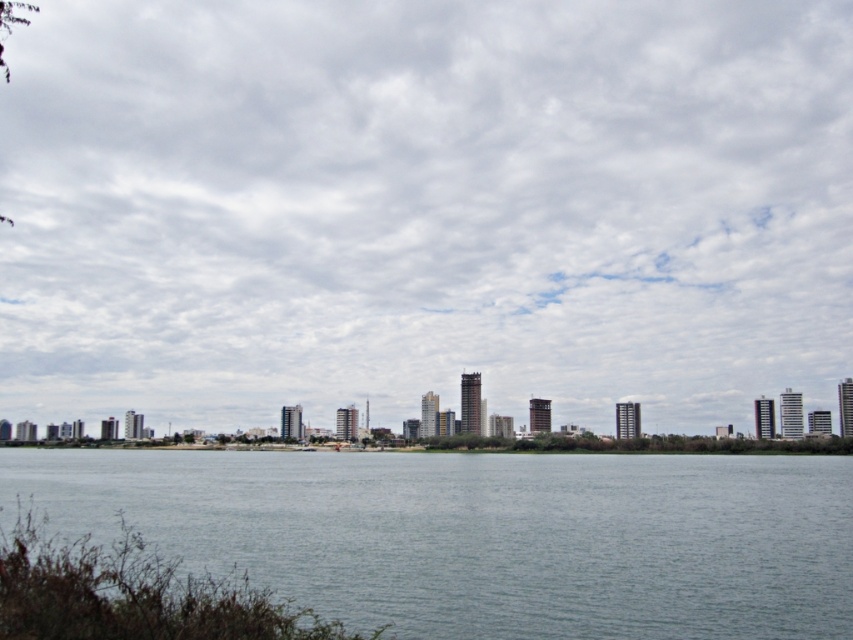
Between point (383, 547) and point (48, 557), which one is positioned behind?

The point (383, 547) is behind.

Who is higher up, gray water at center or green leafy shrub at lower left?

green leafy shrub at lower left is above.

Who is more forward, (213, 496) or (15, 625)?

Point (15, 625) is in front.

Where is `gray water at center`? This screenshot has width=853, height=640. gray water at center is located at coordinates (483, 534).

Is point (178, 221) farther from camera compared to point (582, 481)?

Yes, it is.

Image resolution: width=853 pixels, height=640 pixels. Describe the element at coordinates (424, 209) in the screenshot. I see `cloudy sky at upper center` at that location.

I want to click on cloudy sky at upper center, so click(x=424, y=209).

Who is more distant from viewer, [158,349] or [335,621]?

Positioned behind is point [158,349].

Does cloudy sky at upper center appear over green leafy shrub at lower left?

Yes.

Which is in front, point (154, 307) or point (64, 618)?

Point (64, 618) is in front.

Locate an element on the screen. The image size is (853, 640). cloudy sky at upper center is located at coordinates (424, 209).